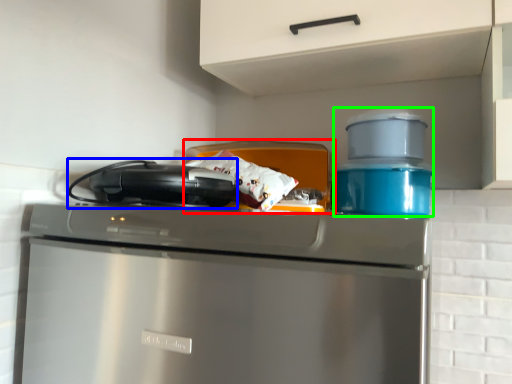
Question: Which object is the closest to the appliance (highlighted by a red box)? Choose among these: kitchen appliance (highlighted by a blue box) or appliance (highlighted by a green box).

Choices:
 (A) kitchen appliance
 (B) appliance

Answer: (B)